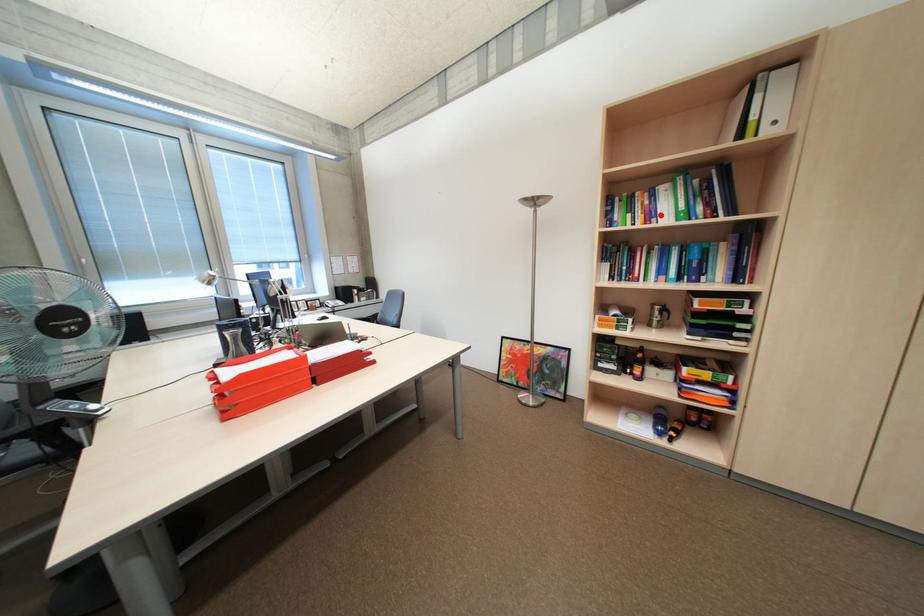
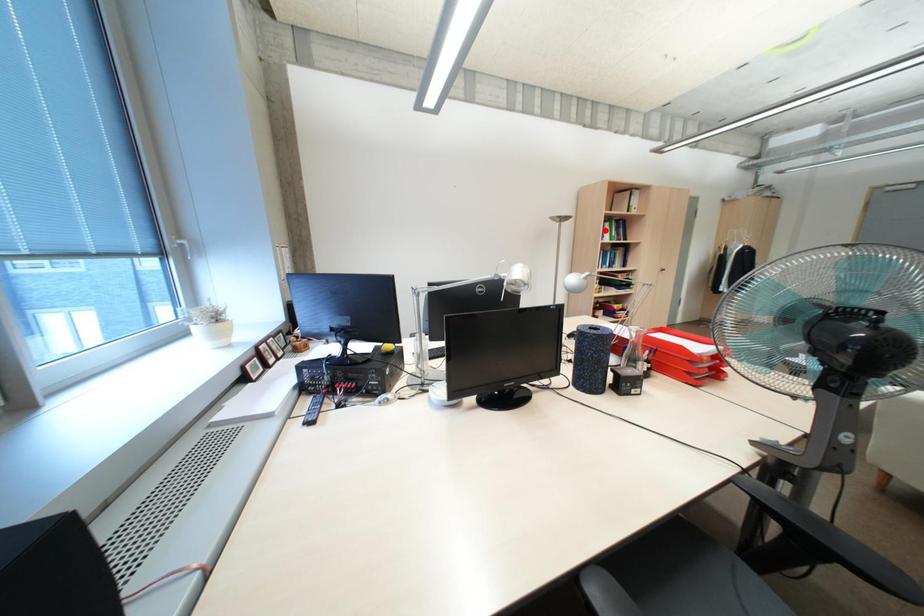
I am providing you with two images of the same scene from different viewpoints. A red point is marked on the first image and another point is marked on the second image. Do the highlighted points in image1 and image2 indicate the same real-world spot?

No